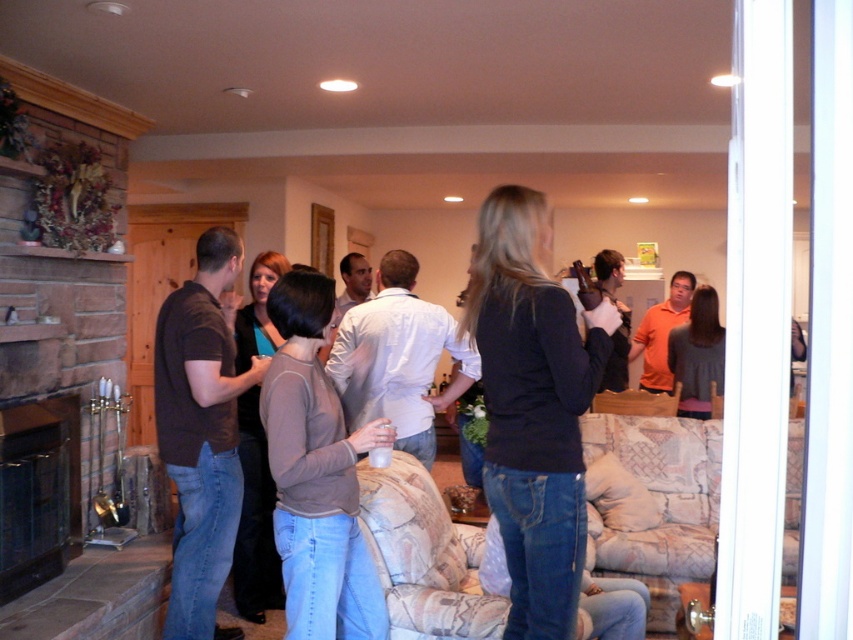
Can you confirm if light brown sweater at center is taller than black stone fireplace at lower left?

Indeed, light brown sweater at center has a greater height compared to black stone fireplace at lower left.

This screenshot has width=853, height=640. Describe the element at coordinates (316, 474) in the screenshot. I see `light brown sweater at center` at that location.

Where is `light brown sweater at center`? The width and height of the screenshot is (853, 640). light brown sweater at center is located at coordinates (316, 474).

Can you confirm if black matte shirt at center is positioned above black stone fireplace at lower left?

Yes, black matte shirt at center is above black stone fireplace at lower left.

Does black matte shirt at center have a lesser height compared to black stone fireplace at lower left?

No.

Measure the distance between black matte shirt at center and camera.

black matte shirt at center is 1.84 meters away from camera.

Identify the location of black matte shirt at center. (532, 404).

Who is more forward, (206, 330) or (720, 342)?

Point (206, 330) is in front.

From the picture: Is dark brown shirt at left bigger than orange cotton shirt at upper right?

Indeed, dark brown shirt at left has a larger size compared to orange cotton shirt at upper right.

You are a GUI agent. You are given a task and a screenshot of the screen. Output one action in this format:
    pyautogui.click(x=<x>, y=<y>)
    Task: Click on the dark brown shirt at left
    
    Given the screenshot: What is the action you would take?
    coord(201,429)